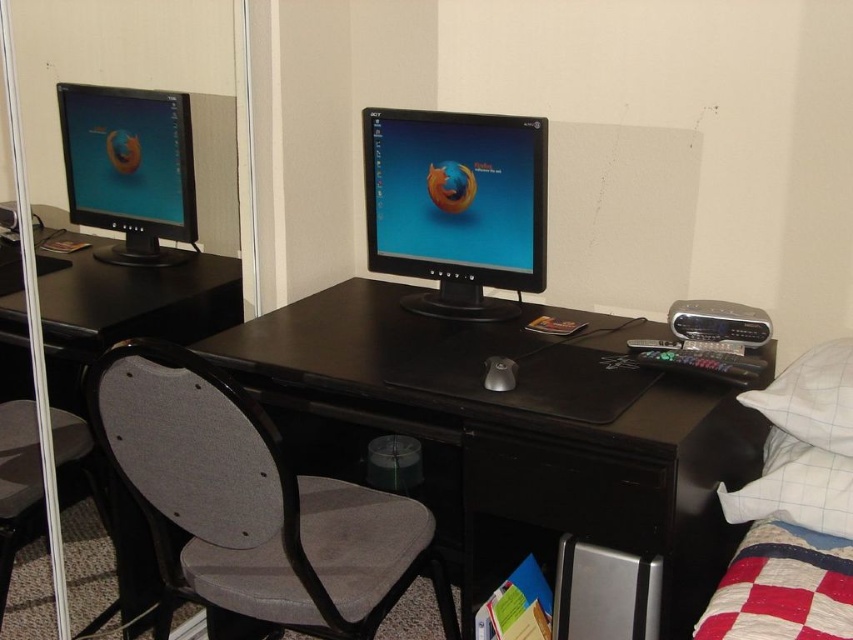
Question: In this image, where is white checkered bedspread at right located relative to black plastic drawer at center?

Choices:
 (A) right
 (B) left

Answer: (A)

Question: Is matte black monitor at center wider than black plastic drawer at center?

Choices:
 (A) yes
 (B) no

Answer: (A)

Question: Observing the image, what is the correct spatial positioning of gray fabric swivel chair at center in reference to matte black monitor at left?

Choices:
 (A) below
 (B) above

Answer: (A)

Question: Which object is the closest to the matte black monitor at left?

Choices:
 (A) black plastic drawer at center
 (B) gray fabric chair at left

Answer: (B)

Question: Which point is closer to the camera taking this photo?

Choices:
 (A) (325, 500)
 (B) (71, 444)
 (C) (578, 496)

Answer: (C)

Question: Which of these objects is positioned closest to the black plastic drawer at center?

Choices:
 (A) gray fabric chair at left
 (B) black glossy monitor at center
 (C) gray fabric swivel chair at center
 (D) matte black monitor at left

Answer: (B)